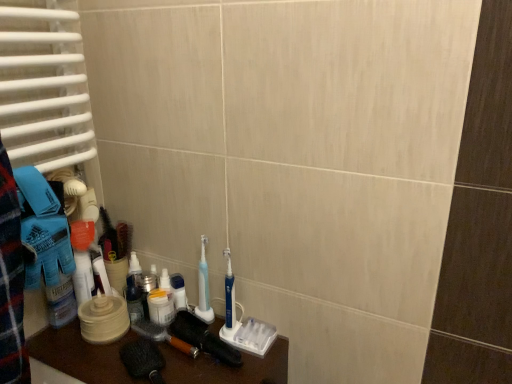
Find the location of `free space in front of white plastic container at center, which is the 1th toiletry from right to left`. free space in front of white plastic container at center, which is the 1th toiletry from right to left is located at coordinates (164, 364).